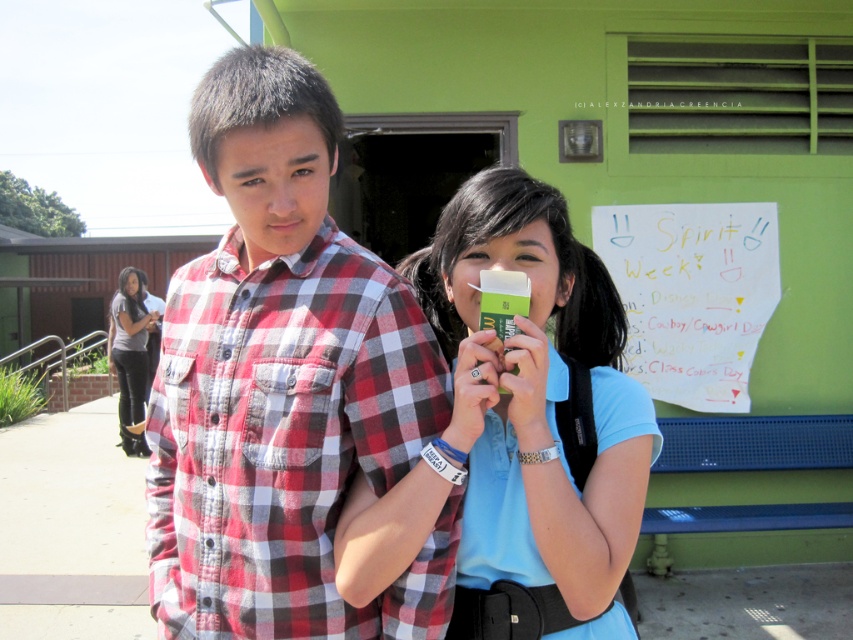
Which is more to the left, plaid cotton shirt at center or white paper at upper right?

From the viewer's perspective, plaid cotton shirt at center appears more on the left side.

Is plaid cotton shirt at center further to the viewer compared to white paper at upper right?

No, plaid cotton shirt at center is closer to the viewer.

Locate an element on the screen. The height and width of the screenshot is (640, 853). plaid cotton shirt at center is located at coordinates (283, 385).

What are the coordinates of `plaid cotton shirt at center` in the screenshot? It's located at (283, 385).

Between white paper at upper right and dark gray jeans at lower left, which one has more height?

dark gray jeans at lower left is taller.

Can you confirm if white paper at upper right is wider than dark gray jeans at lower left?

Yes, white paper at upper right is wider than dark gray jeans at lower left.

Between point (631, 308) and point (131, 380), which one is positioned behind?

Positioned behind is point (131, 380).

You are a GUI agent. You are given a task and a screenshot of the screen. Output one action in this format:
    pyautogui.click(x=<x>, y=<y>)
    Task: Click on the white paper at upper right
    This screenshot has height=640, width=853.
    Given the screenshot: What is the action you would take?
    pyautogui.click(x=692, y=294)

Can you confirm if plaid cotton shirt at center is positioned below matte green eraser at center?

No.

Is plaid cotton shirt at center thinner than matte green eraser at center?

No, plaid cotton shirt at center is not thinner than matte green eraser at center.

I want to click on plaid cotton shirt at center, so click(x=283, y=385).